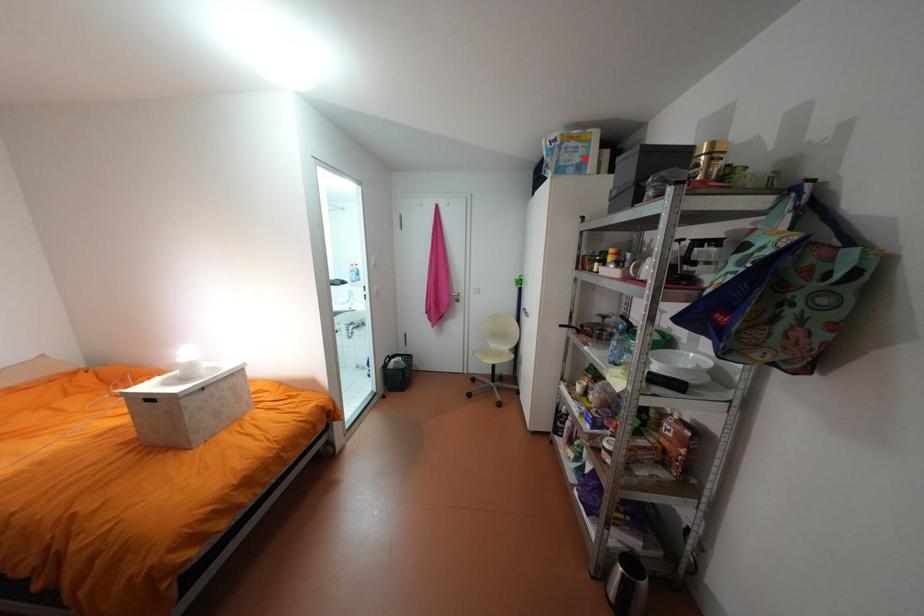
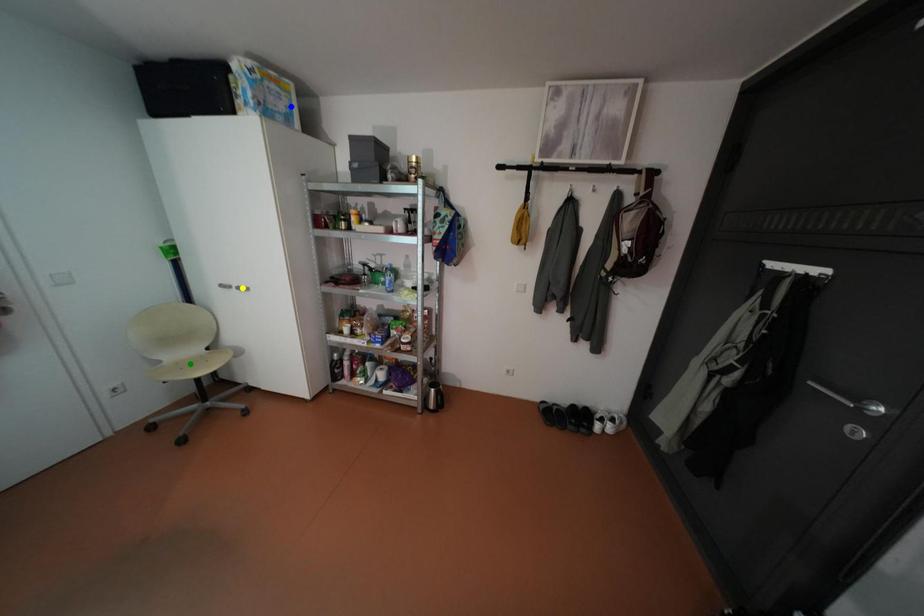
Question: I am providing you with two images of the same scene from different viewpoints. A red point is marked on the first image. You are given multiple points on the second image. In image 2, which mark is for the same physical point as the one in image 1?

Choices:
 (A) yellow point
 (B) blue point
 (C) green point

Answer: (B)